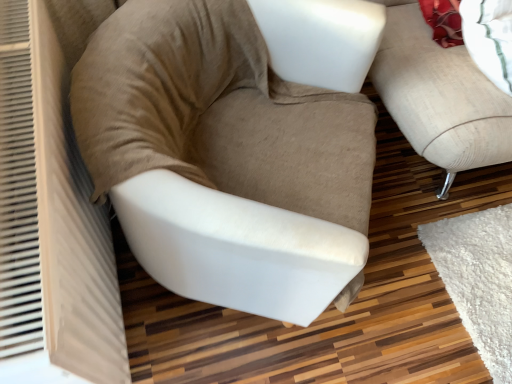
Question: Should I look upward or downward to see beige fabric chair at center?

Choices:
 (A) down
 (B) up

Answer: (B)

Question: Considering the relative positions of beige fabric chair at center and beige fabric studio couch at right in the image provided, is beige fabric chair at center to the right of beige fabric studio couch at right from the viewer's perspective?

Choices:
 (A) yes
 (B) no

Answer: (B)

Question: From a real-world perspective, is beige fabric chair at center positioned over beige fabric studio couch at right based on gravity?

Choices:
 (A) yes
 (B) no

Answer: (B)

Question: From the image's perspective, is beige fabric chair at center below beige fabric studio couch at right?

Choices:
 (A) no
 (B) yes

Answer: (B)

Question: Is beige fabric chair at center bigger than beige fabric studio couch at right?

Choices:
 (A) no
 (B) yes

Answer: (A)

Question: Considering the relative positions of beige fabric chair at center and beige fabric studio couch at right in the image provided, is beige fabric chair at center in front of beige fabric studio couch at right?

Choices:
 (A) no
 (B) yes

Answer: (B)

Question: Considering the relative positions of beige fabric chair at center and beige fabric studio couch at right in the image provided, is beige fabric chair at center to the left of beige fabric studio couch at right from the viewer's perspective?

Choices:
 (A) no
 (B) yes

Answer: (B)

Question: From the image's perspective, would you say beige fabric studio couch at right is shown under beige fabric chair at center?

Choices:
 (A) no
 (B) yes

Answer: (A)

Question: Is beige fabric studio couch at right wider than beige fabric chair at center?

Choices:
 (A) no
 (B) yes

Answer: (B)

Question: Considering the relative positions of beige fabric studio couch at right and beige fabric chair at center in the image provided, is beige fabric studio couch at right to the right of beige fabric chair at center from the viewer's perspective?

Choices:
 (A) yes
 (B) no

Answer: (A)

Question: Is beige fabric studio couch at right further to camera compared to beige fabric chair at center?

Choices:
 (A) yes
 (B) no

Answer: (A)

Question: From a real-world perspective, is beige fabric studio couch at right on top of beige fabric chair at center?

Choices:
 (A) yes
 (B) no

Answer: (A)

Question: Is beige fabric studio couch at right oriented towards beige fabric chair at center?

Choices:
 (A) yes
 (B) no

Answer: (B)

Question: From a real-world perspective, is beige fabric chair at center above or below beige fabric studio couch at right?

Choices:
 (A) below
 (B) above

Answer: (A)